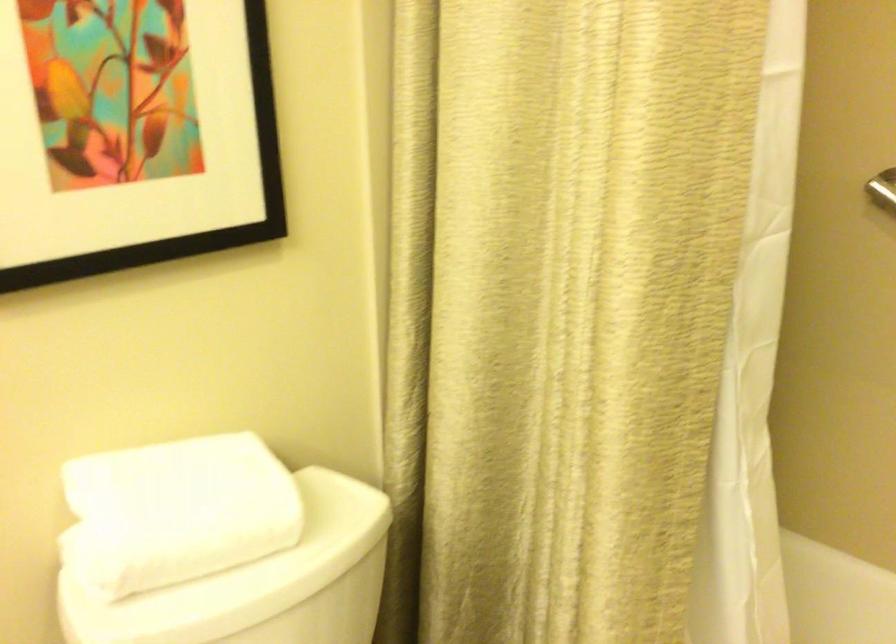
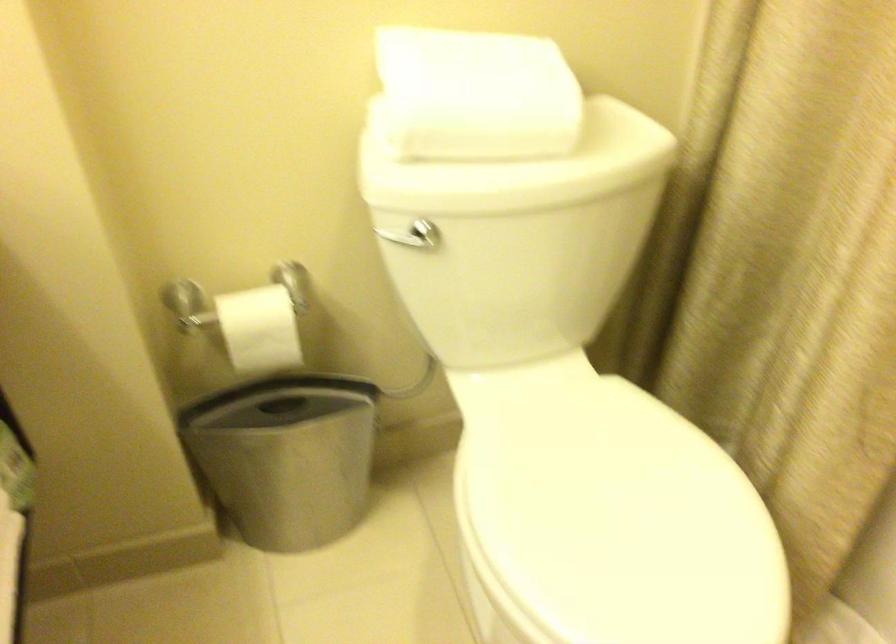
First-person continuous shooting, in which direction is the camera rotating?

The camera's rotation is toward left-down.